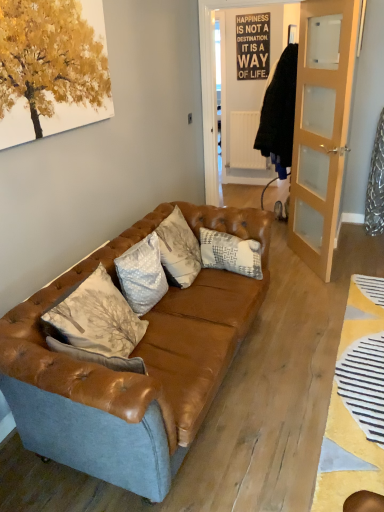
The width and height of the screenshot is (384, 512). In order to click on vacant point to the right of light brown wooden door at right in this screenshot , I will do tap(354, 260).